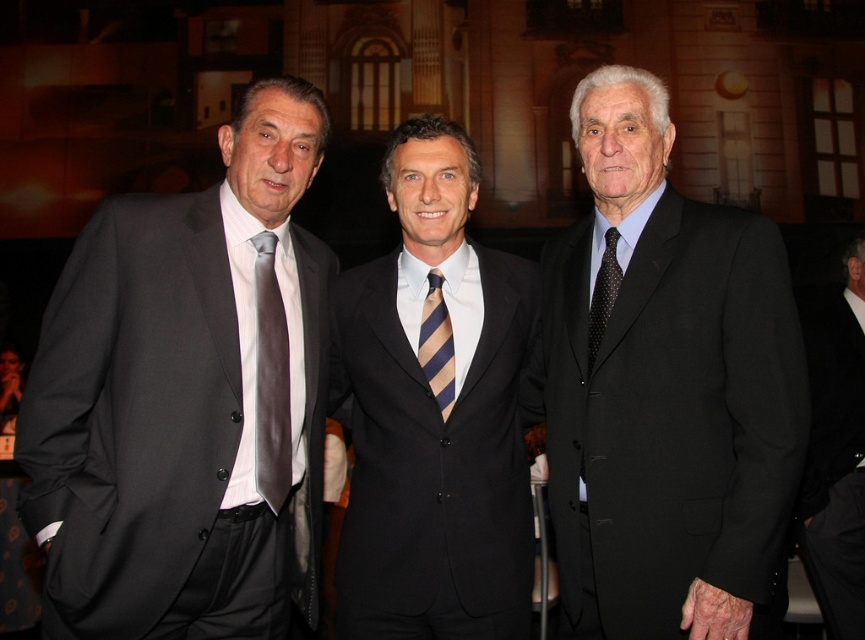
In the scene shown: You are organizing a group photo and need to arrange the three men in order from narrowest to widest based on their clothing. Given that the black matte suit at right might be wider than the black dotted tie at right, which item is wider?

The black matte suit at right is wider than the black dotted tie at right according to the description.

You are a photographer trying to capture a closeup shot of the man on the right. You have a camera with a focal length of 50mm. The man on the right is at point (766, 605) and the man on the left is at point (274, 404). Which point should you focus on to ensure the man on the right is in focus?

You should focus on point (766, 605) because it is closer to the viewer than point (274, 404), ensuring the man on the right is in focus.